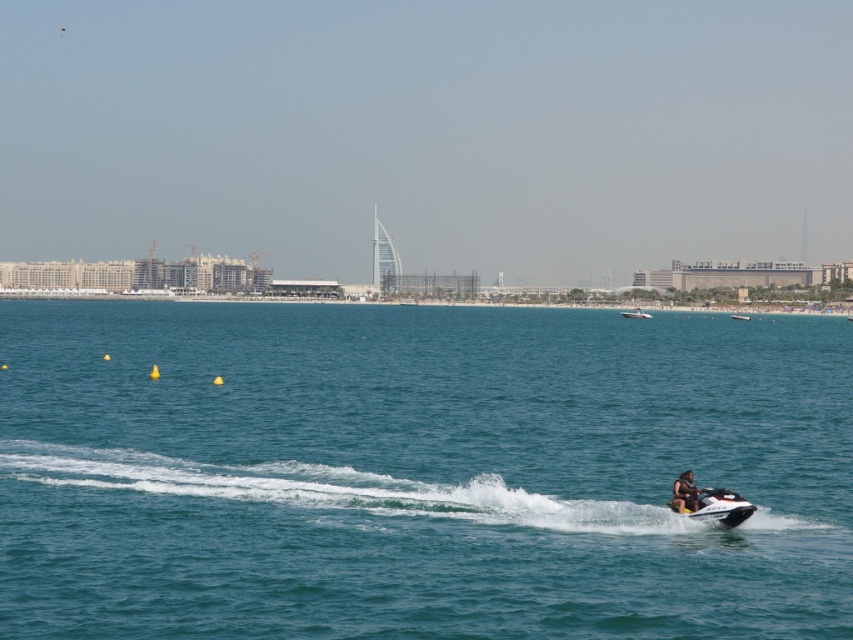
You are a photographer planning to capture a wide shot of the white glossy boat at center and the metallic silver jet ski at center. Given their sizes, which one would appear smaller in the final photo?

The white glossy boat at center would appear smaller in the final photo because it has a lesser width compared to the metallic silver jet ski at center.